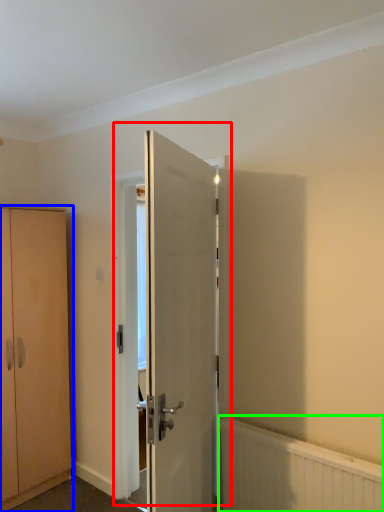
Question: Which is farther away from door (highlighted by a red box)? cabinetry (highlighted by a blue box) or radiator (highlighted by a green box)?

Choices:
 (A) cabinetry
 (B) radiator

Answer: (A)